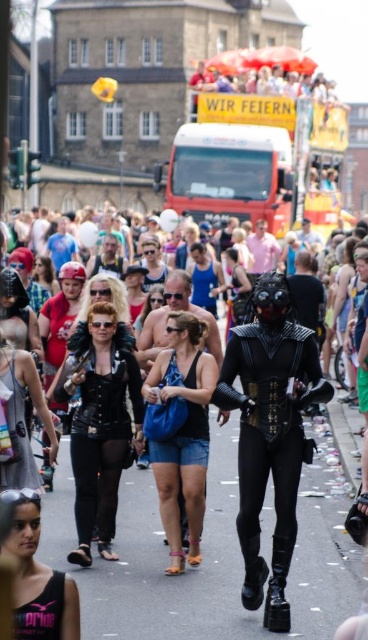
What do you see at coordinates (270, 433) in the screenshot? I see `matte black costume at center` at bounding box center [270, 433].

Can you confirm if matte black costume at center is positioned to the right of satin silver dress at left?

Indeed, matte black costume at center is positioned on the right side of satin silver dress at left.

Between point (260, 388) and point (11, 458), which one is positioned in front?

Positioned in front is point (260, 388).

Find the location of a particular element. The width and height of the screenshot is (368, 640). matte black costume at center is located at coordinates (270, 433).

Between point (138, 365) and point (2, 346), which one is positioned in front?

Point (138, 365) is more forward.

In the scene shown: Between leather jacket at center and satin silver dress at left, which one is positioned lower?

leather jacket at center is lower down.

Which is in front, point (78, 560) or point (18, 461)?

Positioned in front is point (78, 560).

Image resolution: width=368 pixels, height=640 pixels. I want to click on leather jacket at center, so click(100, 422).

Locate an element on the screen. blue denim shorts at center is located at coordinates (182, 433).